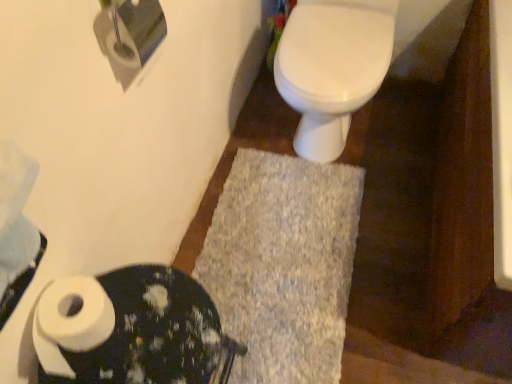
The width and height of the screenshot is (512, 384). I want to click on unoccupied region to the right of white matte toilet paper at lower left, acting as the 1th toilet paper starting from the bottom, so click(161, 331).